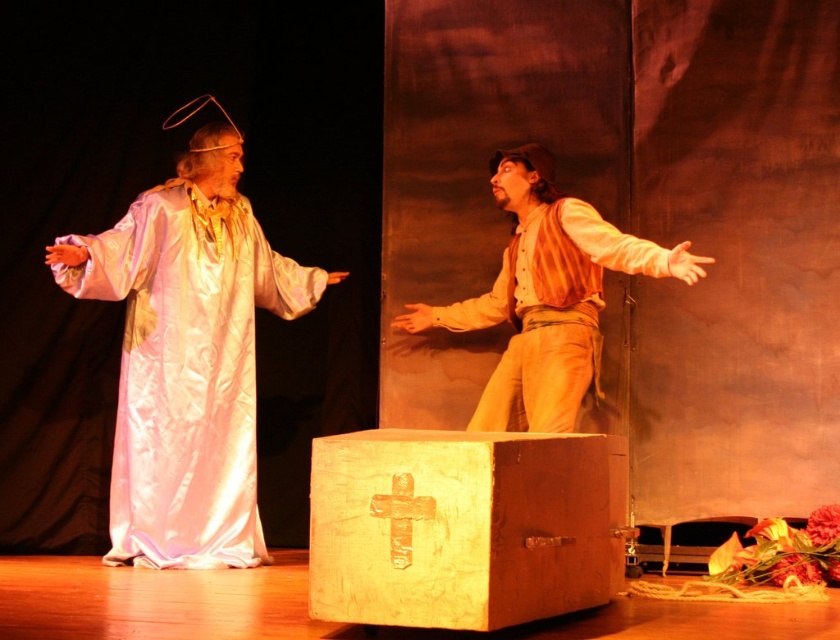
Question: Does silky white robe at left appear over matte brown shirt at center?

Choices:
 (A) no
 (B) yes

Answer: (A)

Question: Which point is farther to the camera?

Choices:
 (A) silky white robe at left
 (B) matte brown shirt at center

Answer: (A)

Question: Which of the following is the farthest from the observer?

Choices:
 (A) wooden box with cross at center
 (B) matte brown shirt at center
 (C) silky white robe at left

Answer: (C)

Question: Does wooden box with cross at center appear on the left side of matte brown shirt at center?

Choices:
 (A) no
 (B) yes

Answer: (B)

Question: Among these objects, which one is farthest from the camera?

Choices:
 (A) matte brown shirt at center
 (B) wooden box with cross at center
 (C) silky white robe at left

Answer: (C)

Question: Is silky white robe at left wider than wooden box with cross at center?

Choices:
 (A) no
 (B) yes

Answer: (B)